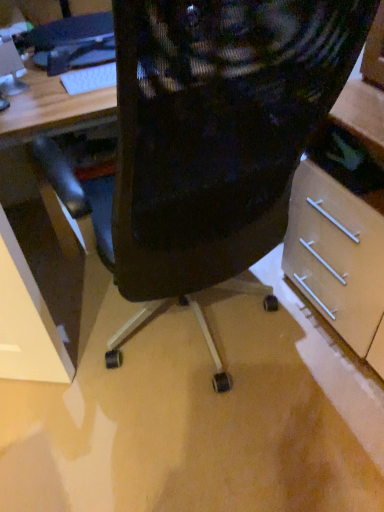
The width and height of the screenshot is (384, 512). Identify the location of black mesh chair at center. (208, 136).

Find the location of a particular element. The image size is (384, 512). black plastic keyboard at upper left is located at coordinates (71, 42).

Image resolution: width=384 pixels, height=512 pixels. I want to click on matte black monitor at upper left, so click(x=11, y=69).

This screenshot has height=512, width=384. In order to click on black mesh chair at center in this screenshot , I will do `click(208, 136)`.

Can you confirm if matte black monitor at upper left is thinner than white plastic keyboard at upper left?

Indeed, matte black monitor at upper left has a lesser width compared to white plastic keyboard at upper left.

Is matte black monitor at upper left aimed at white plastic keyboard at upper left?

No, matte black monitor at upper left does not turn towards white plastic keyboard at upper left.

Looking at this image, does matte black monitor at upper left lie behind white plastic keyboard at upper left?

No, matte black monitor at upper left is closer to the viewer.

Is point (199, 189) closer to viewer compared to point (100, 62)?

Yes, point (199, 189) is in front of point (100, 62).

From the image's perspective, between black mesh chair at center and black plastic keyboard at upper left, which one is located above?

black plastic keyboard at upper left is shown above in the image.

Is black mesh chair at center positioned far away from black plastic keyboard at upper left?

Actually, black mesh chair at center and black plastic keyboard at upper left are a little close together.

Which object is more forward, black mesh chair at center or black plastic keyboard at upper left?

black mesh chair at center.

Consider the image. In the image, is matte black monitor at upper left positioned in front of or behind black mesh chair at center?

matte black monitor at upper left is positioned farther from the viewer than black mesh chair at center.

Find the location of a particular element. chair in front of the matte black monitor at upper left is located at coordinates click(208, 136).

Is matte black monitor at upper left far away from black mesh chair at center?

No.

Is matte black monitor at upper left oriented away from black mesh chair at center?

That's not correct — matte black monitor at upper left is not looking away from black mesh chair at center.

Is black plastic keyboard at upper left with white plastic keyboard at upper left?

No, black plastic keyboard at upper left is not touching white plastic keyboard at upper left.

Is black plastic keyboard at upper left inside or outside of white plastic keyboard at upper left?

black plastic keyboard at upper left is outside white plastic keyboard at upper left.

From a real-world perspective, who is located lower, black plastic keyboard at upper left or white plastic keyboard at upper left?

white plastic keyboard at upper left.

Which is in front, black plastic keyboard at upper left or white plastic keyboard at upper left?

white plastic keyboard at upper left is closer to the camera.

Would you say black mesh chair at center is part of black plastic keyboard at upper left's contents?

No.

Is black plastic keyboard at upper left facing away from black mesh chair at center?

No, black plastic keyboard at upper left is not facing the opposite direction of black mesh chair at center.

Based on the photo, from a real-world perspective, is black plastic keyboard at upper left positioned over black mesh chair at center based on gravity?

Yes, from a real-world perspective, black plastic keyboard at upper left is on top of black mesh chair at center.

From the picture: Can we say black mesh chair at center lies outside white plastic keyboard at upper left?

Yes.

Are black mesh chair at center and white plastic keyboard at upper left making contact?

No, black mesh chair at center is not in contact with white plastic keyboard at upper left.

Which is more to the right, black mesh chair at center or white plastic keyboard at upper left?

Positioned to the right is black mesh chair at center.

Does black mesh chair at center have a smaller size compared to white plastic keyboard at upper left?

No, black mesh chair at center is not smaller than white plastic keyboard at upper left.

Is white plastic keyboard at upper left looking in the opposite direction of matte black monitor at upper left?

That's not correct — white plastic keyboard at upper left is not looking away from matte black monitor at upper left.

Is white plastic keyboard at upper left not within matte black monitor at upper left?

white plastic keyboard at upper left is positioned outside matte black monitor at upper left.

From the image's perspective, is white plastic keyboard at upper left positioned above or below matte black monitor at upper left?

From the image's perspective, white plastic keyboard at upper left appears below matte black monitor at upper left.

Can you confirm if white plastic keyboard at upper left is thinner than matte black monitor at upper left?

No.

Locate an element on the screen. Image resolution: width=384 pixels, height=512 pixels. computer monitor above the white plastic keyboard at upper left (from the image's perspective) is located at coordinates (11, 69).

I want to click on computer on the left of the black mesh chair at center, so click(x=71, y=42).

When comparing their distances from black plastic keyboard at upper left, does black mesh chair at center or matte black monitor at upper left seem further?

The object further to black plastic keyboard at upper left is black mesh chair at center.

Based on their spatial positions, is matte black monitor at upper left or black plastic keyboard at upper left further from white plastic keyboard at upper left?

matte black monitor at upper left is further to white plastic keyboard at upper left.

Estimate the real-world distances between objects in this image. Which object is further from black mesh chair at center, white plastic keyboard at upper left or matte black monitor at upper left?

matte black monitor at upper left.

Which object lies further to the anchor point black mesh chair at center, matte black monitor at upper left or white plastic keyboard at upper left?

matte black monitor at upper left is further to black mesh chair at center.

From the picture: From the image, which object appears to be farther from black plastic keyboard at upper left, matte black monitor at upper left or white plastic keyboard at upper left?

matte black monitor at upper left is positioned further to the anchor black plastic keyboard at upper left.

Estimate the real-world distances between objects in this image. Which object is further from matte black monitor at upper left, white plastic keyboard at upper left or black mesh chair at center?

Based on the image, black mesh chair at center appears to be further to matte black monitor at upper left.

Which object lies further to the anchor point black plastic keyboard at upper left, white plastic keyboard at upper left or matte black monitor at upper left?

The object further to black plastic keyboard at upper left is matte black monitor at upper left.

Estimate the real-world distances between objects in this image. Which object is further from matte black monitor at upper left, white plastic keyboard at upper left or black plastic keyboard at upper left?

white plastic keyboard at upper left is positioned further to the anchor matte black monitor at upper left.

Locate an element on the screen. The image size is (384, 512). computer monitor between black mesh chair at center and black plastic keyboard at upper left along the z-axis is located at coordinates (11, 69).

Where is `computer between matte black monitor at upper left and white plastic keyboard at upper left`? The width and height of the screenshot is (384, 512). computer between matte black monitor at upper left and white plastic keyboard at upper left is located at coordinates (71, 42).

Find the location of a particular element. computer monitor positioned between black mesh chair at center and white plastic keyboard at upper left from near to far is located at coordinates (x=11, y=69).

Locate an element on the screen. keyboard positioned between black mesh chair at center and black plastic keyboard at upper left from near to far is located at coordinates (89, 79).